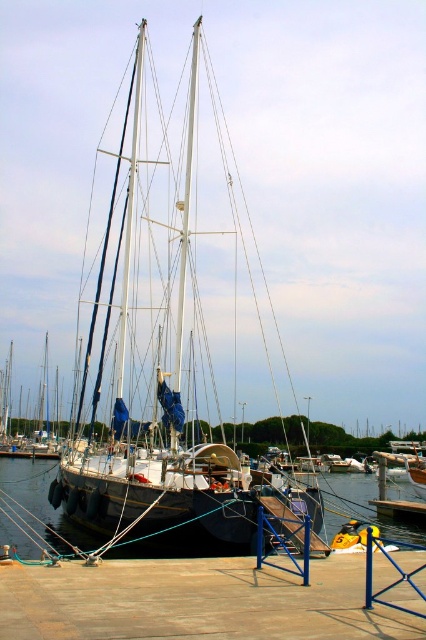
Question: Is white matte sailboat at center smaller than black rubber boat at center?

Choices:
 (A) no
 (B) yes

Answer: (B)

Question: Among these objects, which one is farthest from the camera?

Choices:
 (A) brown wooden dock at lower center
 (B) white matte sailboat at center
 (C) black rubber boat at center

Answer: (C)

Question: Among these points, which one is farthest from the camera?

Choices:
 (A) (126, 458)
 (B) (42, 467)
 (C) (175, 595)

Answer: (B)

Question: Does brown wooden dock at lower center come in front of black rubber boat at center?

Choices:
 (A) no
 (B) yes

Answer: (B)

Question: Does brown wooden dock at lower center appear over white matte sailboat at center?

Choices:
 (A) no
 (B) yes

Answer: (A)

Question: Which point is farther to the camera?

Choices:
 (A) (134, 148)
 (B) (368, 497)

Answer: (B)